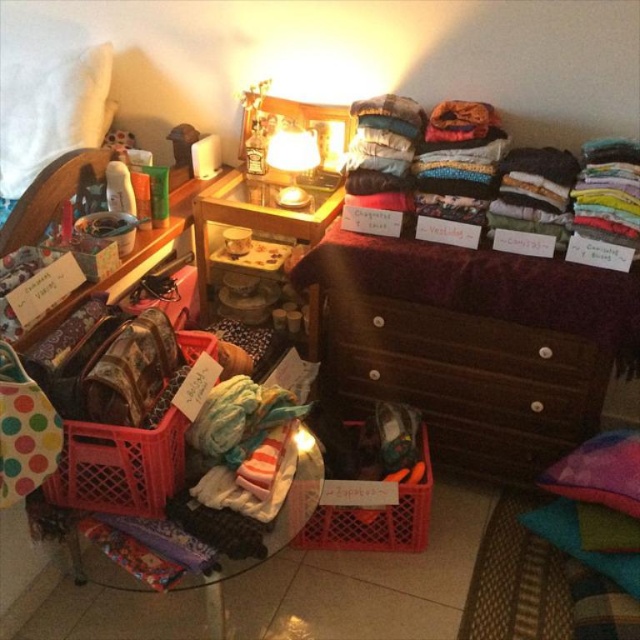
Is point (317, 515) farther from viewer compared to point (296, 198)?

No.

Image resolution: width=640 pixels, height=640 pixels. What are the coordinates of `translucent plastic basket at lower center` in the screenshot? It's located at 376,518.

Between brown wooden dresser at center and translucent plastic basket at lower left, which one is positioned lower?

translucent plastic basket at lower left is lower down.

Based on the photo, is brown wooden dresser at center to the left of translucent plastic basket at lower left from the viewer's perspective?

Incorrect, brown wooden dresser at center is not on the left side of translucent plastic basket at lower left.

In order to click on brown wooden dresser at center in this screenshot , I will do pyautogui.click(x=472, y=344).

Between brown wooden dresser at center and matte glass lamp at upper center, which one has more height?

With more height is brown wooden dresser at center.

Consider the image. Can you confirm if brown wooden dresser at center is thinner than matte glass lamp at upper center?

Incorrect, brown wooden dresser at center's width is not less than matte glass lamp at upper center's.

Does point (522, 456) come farther from viewer compared to point (310, 132)?

No.

The image size is (640, 640). I want to click on brown wooden dresser at center, so click(x=472, y=344).